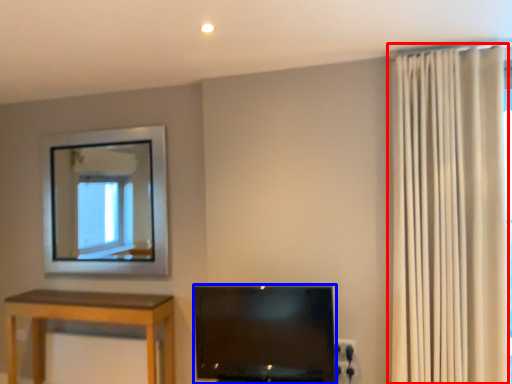
Question: Which object is further to the camera taking this photo, curtain (highlighted by a red box) or television (highlighted by a blue box)?

Choices:
 (A) curtain
 (B) television

Answer: (B)